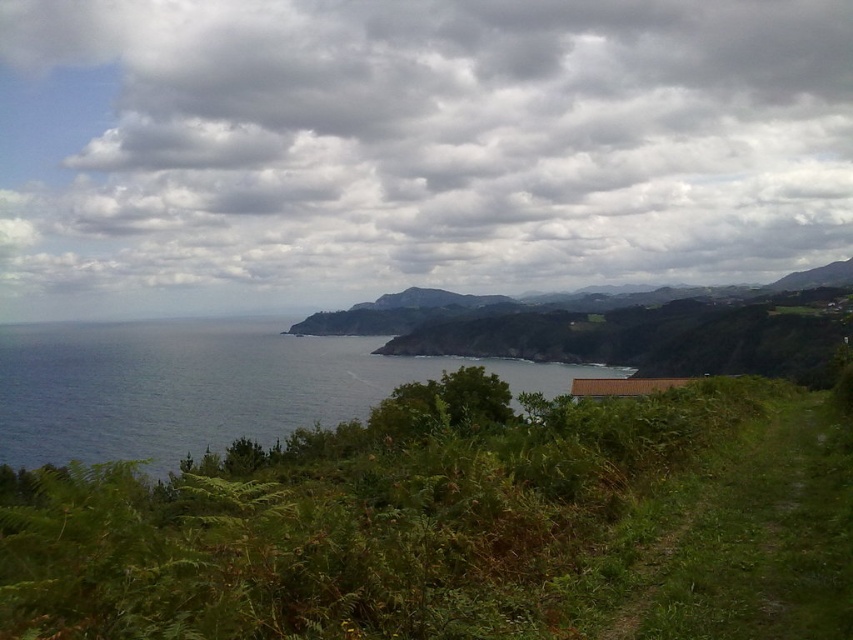
Is green leafy shrubs at lower left smaller than blue water at left?

Yes, green leafy shrubs at lower left is smaller than blue water at left.

Between point (570, 490) and point (200, 330), which one is positioned behind?

Positioned behind is point (200, 330).

Looking at this image, who is more distant from viewer, (351, 513) or (164, 342)?

The point (164, 342) is behind.

Find the location of a particular element. green leafy shrubs at lower left is located at coordinates (354, 520).

Is point (834, 92) positioned in front of point (88, 355)?

That is False.

Which is behind, point (451, 212) or point (0, 417)?

Point (451, 212)

Image resolution: width=853 pixels, height=640 pixels. What are the coordinates of `cloudy sky at upper center` in the screenshot? It's located at (421, 141).

Can you confirm if cloudy sky at upper center is taller than green leafy shrubs at lower left?

Correct, cloudy sky at upper center is much taller as green leafy shrubs at lower left.

Does point (817, 109) come closer to viewer compared to point (683, 435)?

No.

Measure the distance between point (x=370, y=138) and camera.

A distance of 1012.02 feet exists between point (x=370, y=138) and camera.

What are the coordinates of `cloudy sky at upper center` in the screenshot? It's located at (421, 141).